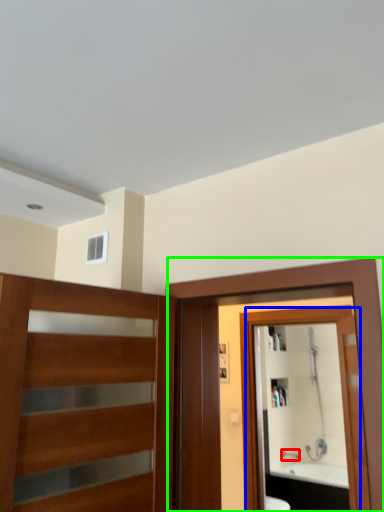
Question: Based on their relative distances, which object is nearer to faucet (highlighted by a red box)? Choose from mirror (highlighted by a blue box) and screen door (highlighted by a green box).

Choices:
 (A) mirror
 (B) screen door

Answer: (A)